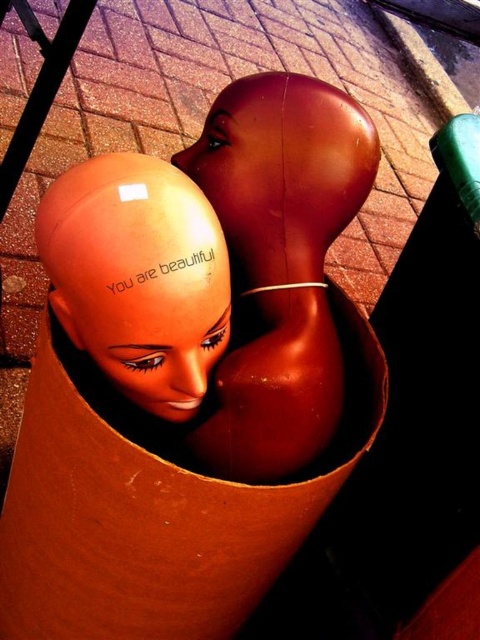
Question: Which object appears closest to the camera in this image?

Choices:
 (A) glossy brown mannequin head at center
 (B) matte orange head at center
 (C) glossy plastic head at center

Answer: (B)

Question: Which object is farther from the camera taking this photo?

Choices:
 (A) matte orange head at center
 (B) glossy plastic head at center

Answer: (B)

Question: Is glossy brown mannequin head at center closer to camera compared to matte orange head at center?

Choices:
 (A) no
 (B) yes

Answer: (A)

Question: Does matte orange head at center come in front of glossy plastic head at center?

Choices:
 (A) no
 (B) yes

Answer: (B)

Question: Is glossy brown mannequin head at center wider than glossy plastic head at center?

Choices:
 (A) yes
 (B) no

Answer: (A)

Question: Which object is farther from the camera taking this photo?

Choices:
 (A) matte orange head at center
 (B) glossy plastic head at center
 (C) glossy brown mannequin head at center

Answer: (B)